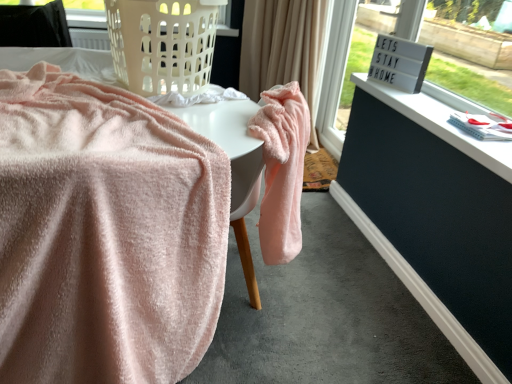
Question: Is white plastic laundry basket at upper left spatially inside beige fabric curtain at upper center, or outside of it?

Choices:
 (A) inside
 (B) outside

Answer: (B)

Question: Looking at their shapes, would you say white plastic laundry basket at upper left is wider or thinner than beige fabric curtain at upper center?

Choices:
 (A) wide
 (B) thin

Answer: (A)

Question: Based on their relative distances, which object is nearer to the white matte window sill at upper right?

Choices:
 (A) black fabric at upper left
 (B) beige fabric curtain at upper center
 (C) soft pink towel at center, the 2th table viewed from the right
 (D) dark blue painted wood dresser at lower right
 (E) white plastic laundry basket at upper left

Answer: (D)

Question: Which object is positioned closest to the white plastic laundry basket at upper left?

Choices:
 (A) dark blue painted wood dresser at lower right
 (B) black fabric at upper left
 (C) beige fabric curtain at upper center
 (D) soft pink towel at center, arranged as the 1th table when viewed from the left
 (E) white matte window sill at upper right

Answer: (D)